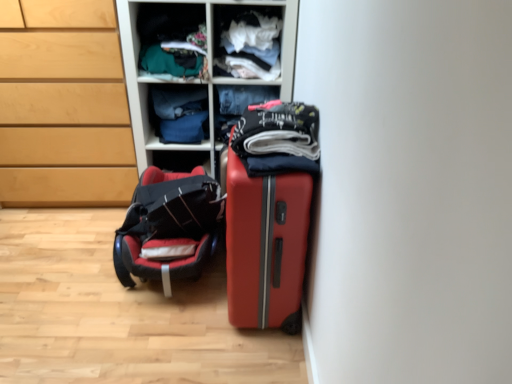
The image size is (512, 384). Find the location of `free space in front of black leather baby car seat at lower left`. free space in front of black leather baby car seat at lower left is located at coordinates (135, 341).